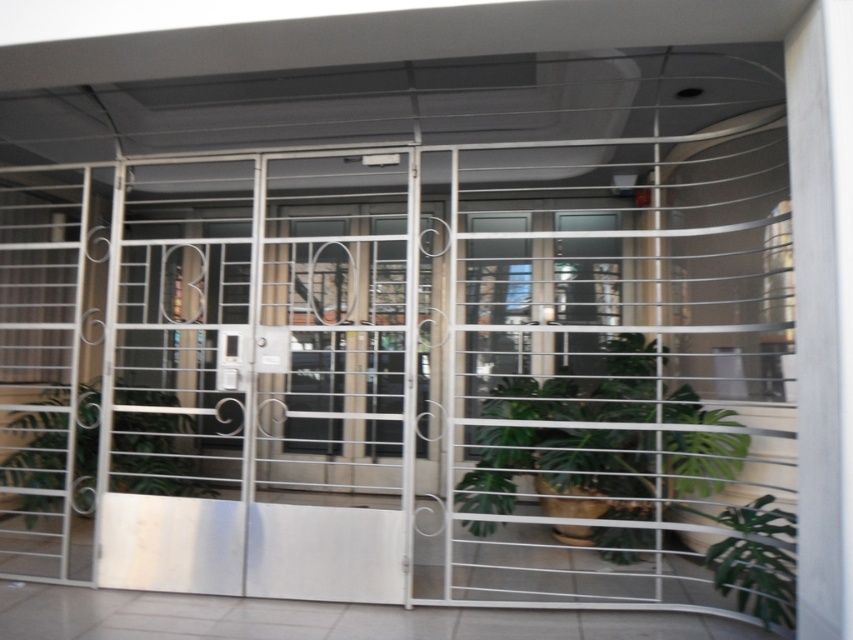
You are a delivery person approaching the entrance and need to place a package between the green leafy plant at center and the green leafy plant at lower right. Which plant has a larger width to accommodate the package?

The green leafy plant at center might be wider than the green leafy plant at lower right, so it can accommodate the package better.

You are standing in front of the entrance and want to take a photo. There are two points marked on the security gate at coordinates point (694, 461) and point (15, 451). Which point is closer to your camera when you take the photo?

Point (694, 461) is closer to the camera than point (15, 451).

You are a delivery person with a 30 inch wide package. You need to place it between the green leafy plant at center and the green leafy plant at lower right. Is there enough space?

The distance between the green leafy plant at center and the green leafy plant at lower right is 29.65 inches. Since the package is 30 inches wide, there isn not enough space to place it between them.